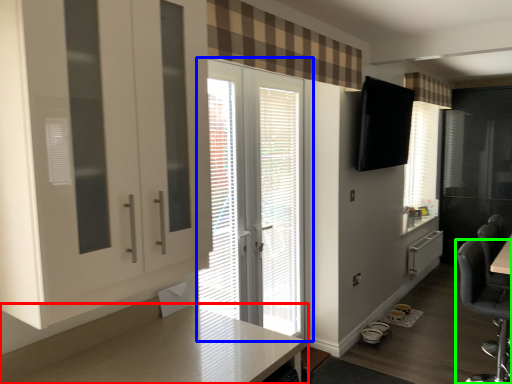
Question: Estimate the real-world distances between objects in this image. Which object is farther from countertop (highlighted by a red box), door (highlighted by a blue box) or chair (highlighted by a green box)?

Choices:
 (A) door
 (B) chair

Answer: (B)